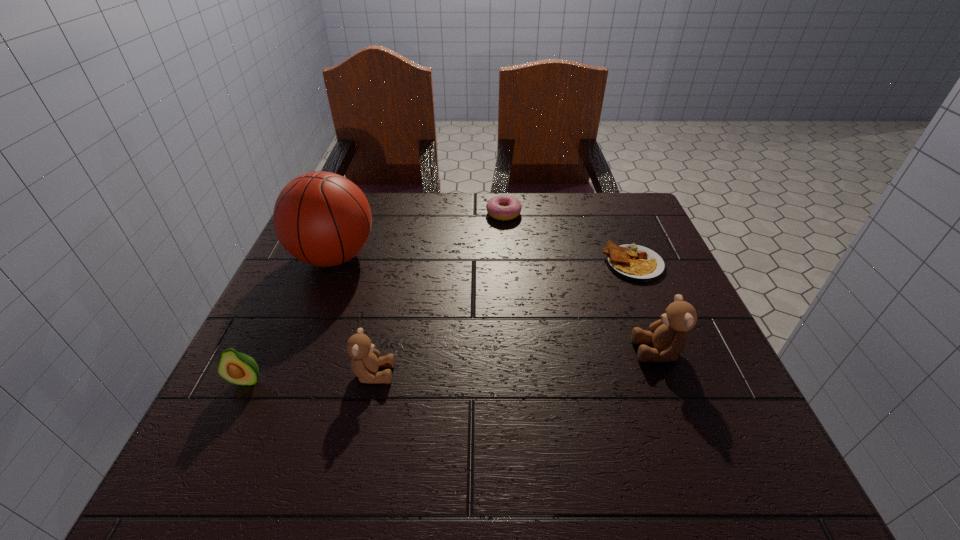
Please mark a free spot for a new teddy_bear to balance the arrangement. Please provide its 2D coordinates. Your answer should be formatted as a tuple, i.e. [(x, y)], where the tuple contains the x and y coordinates of a point satisfying the conditions above.

[(519, 362)]